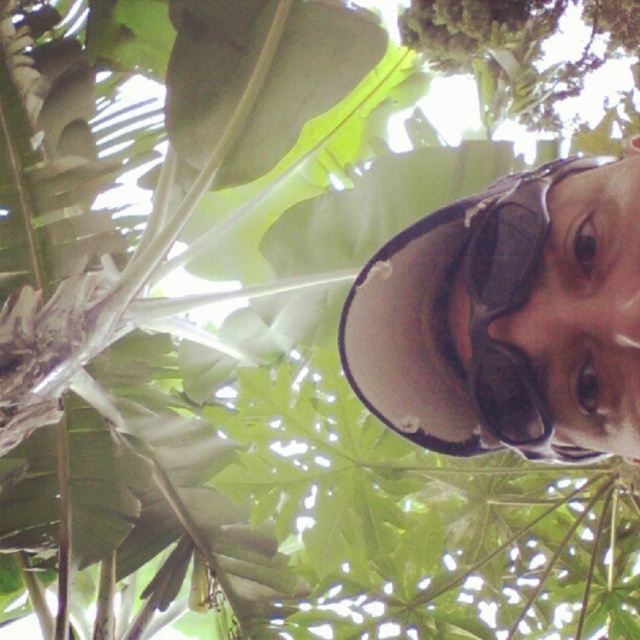
Is the position of white matte hat at upper center more distant than that of black matte goggles at upper right?

No, it is in front of black matte goggles at upper right.

Between point (362, 400) and point (492, 312), which one is positioned in front?

Point (492, 312) is in front.

I want to click on white matte hat at upper center, so click(492, 314).